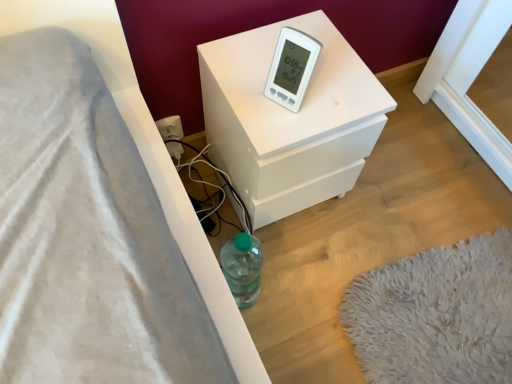
I want to click on blank space above white matte nightstand at center (from a real-world perspective), so [313, 89].